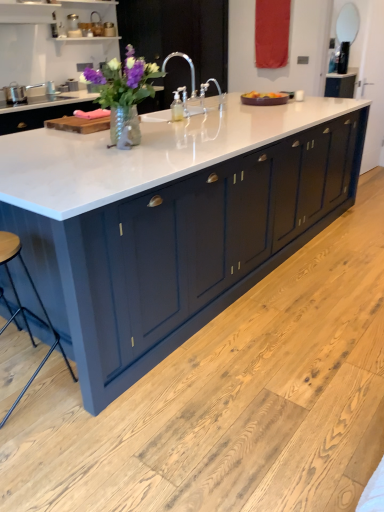
This screenshot has width=384, height=512. In order to click on free space in front of matte glass vase at center in this screenshot , I will do `click(129, 164)`.